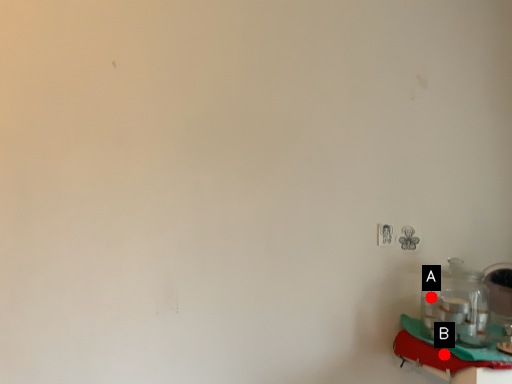
Question: Two points are circled on the image, labeled by A and B beside each circle. Which point appears farthest from the camera in this image?

Choices:
 (A) A is further
 (B) B is further

Answer: (A)